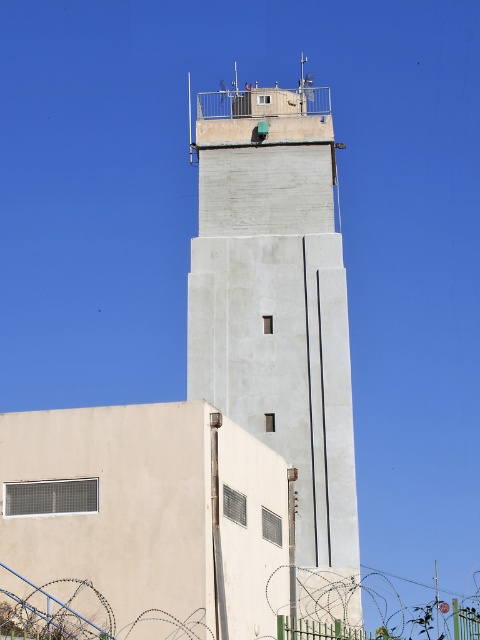
Question: Is concrete tower at upper center in front of green wire mesh fence at center?

Choices:
 (A) yes
 (B) no

Answer: (B)

Question: Which point appears farthest from the camera in this image?

Choices:
 (A) (280, 99)
 (B) (315, 632)

Answer: (A)

Question: Which point appears farthest from the camera in this image?

Choices:
 (A) (317, 637)
 (B) (207, 323)

Answer: (B)

Question: Considering the relative positions of concrete tower at upper center and green wire mesh fence at center in the image provided, where is concrete tower at upper center located with respect to green wire mesh fence at center?

Choices:
 (A) above
 (B) below

Answer: (A)

Question: Does concrete tower at upper center appear under green wire mesh fence at center?

Choices:
 (A) yes
 (B) no

Answer: (B)